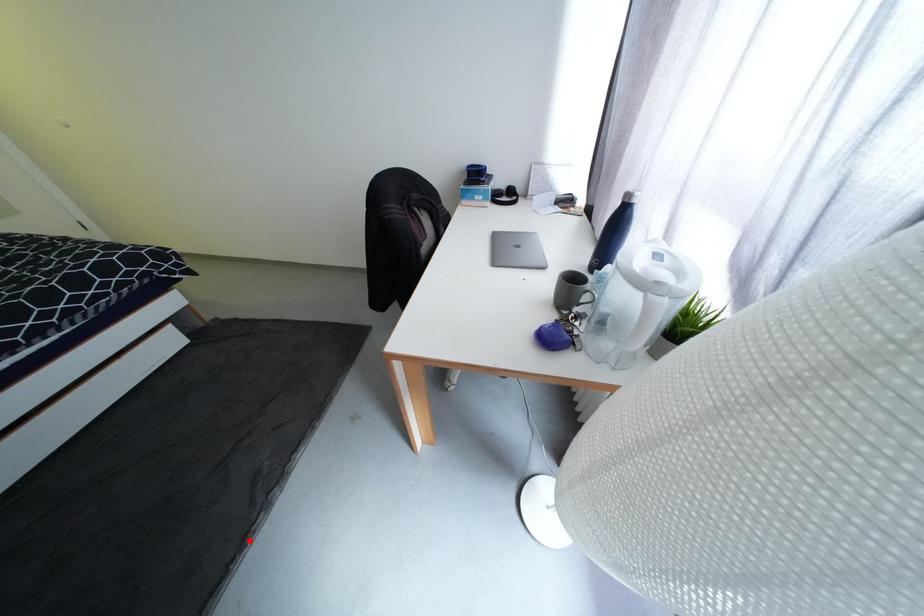
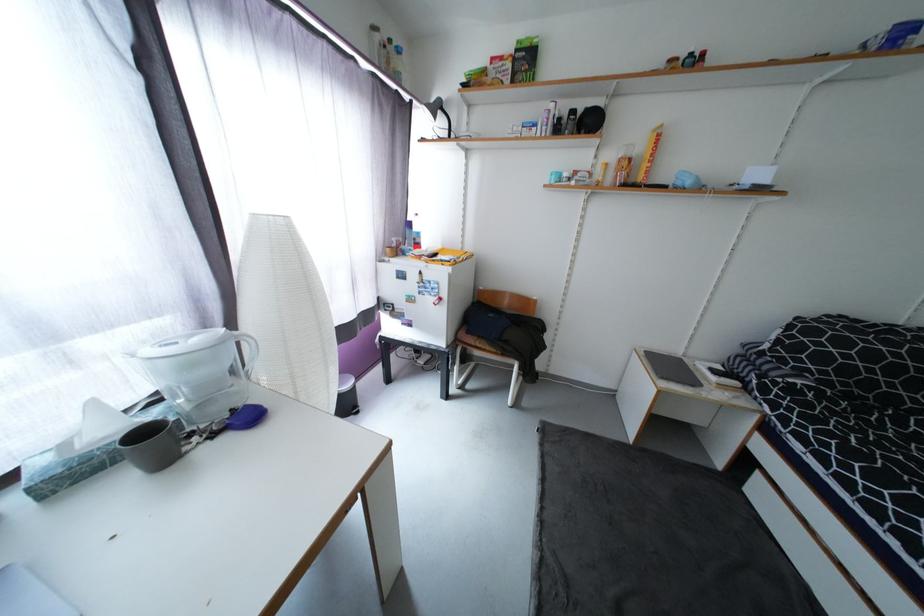
Find the pixel in the second image that matches the highlighted location in the first image.

(548, 524)